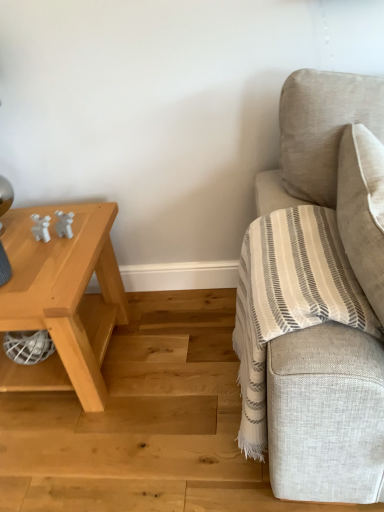
This screenshot has width=384, height=512. I want to click on natural wood stair at lower right, so click(x=143, y=422).

This screenshot has height=512, width=384. Find the location of `beige fabric couch at right`. beige fabric couch at right is located at coordinates (326, 415).

In order to face light wood table at left, should I rotate leftwards or rightwards?

You should look left and rotate roughly 19.737 degrees.

I want to click on natural wood stair at lower right, so click(x=143, y=422).

In the scene shown: Can you confirm if natural wood stair at lower right is positioned to the right of light wood table at left?

Indeed, natural wood stair at lower right is positioned on the right side of light wood table at left.

From the image's perspective, is natural wood stair at lower right under light wood table at left?

Correct, natural wood stair at lower right appears lower than light wood table at left in the image.

Is natural wood stair at lower right looking in the opposite direction of light wood table at left?

That's not correct — natural wood stair at lower right is not looking away from light wood table at left.

Can you confirm if natural wood stair at lower right is wider than light wood table at left?

Yes, natural wood stair at lower right is wider than light wood table at left.

Which object is further away from the camera, light wood table at left or natural wood stair at lower right?

light wood table at left.

Where is `table above the natural wood stair at lower right (from the image's perspective)`? The height and width of the screenshot is (512, 384). table above the natural wood stair at lower right (from the image's perspective) is located at coordinates (63, 298).

Could you tell me if light wood table at left is turned towards natural wood stair at lower right?

Yes, light wood table at left is oriented towards natural wood stair at lower right.

From the image's perspective, which is above, beige fabric couch at right or light wood table at left?

beige fabric couch at right is shown above in the image.

Is point (277, 390) in front of point (71, 336)?

Yes, it is in front of point (71, 336).

Is beige fabric couch at right turned away from light wood table at left?

That's right, beige fabric couch at right is facing away from light wood table at left.

From a real-world perspective, which object stands above the other?

beige fabric couch at right.

Is point (72, 301) positioned after point (331, 466)?

Yes, it is.

Which of these two, light wood table at left or beige fabric couch at right, is wider?

With larger width is light wood table at left.

Is light wood table at left next to beige fabric couch at right?

They are not placed beside each other.

Who is shorter, light wood table at left or beige fabric couch at right?

Standing shorter between the two is light wood table at left.

From a real-world perspective, between beige fabric couch at right and natural wood stair at lower right, who is vertically higher?

In real-world perspective, beige fabric couch at right is above.

Between beige fabric couch at right and natural wood stair at lower right, which one appears on the right side from the viewer's perspective?

beige fabric couch at right.

From the picture: From a real-world perspective, is natural wood stair at lower right above or below beige fabric couch at right?

In terms of real-world spatial position, natural wood stair at lower right is below beige fabric couch at right.

Which is closer to the camera, (145, 487) or (349, 355)?

Point (145, 487).

You are a GUI agent. You are given a task and a screenshot of the screen. Output one action in this format:
    pyautogui.click(x=<x>, y=<y>)
    Task: Click on the stair behind the beige fabric couch at right
    The image size is (384, 512).
    Given the screenshot: What is the action you would take?
    pyautogui.click(x=143, y=422)

In the image, is natural wood stair at lower right on the left side or the right side of beige fabric couch at right?

Clearly, natural wood stair at lower right is on the left of beige fabric couch at right in the image.

I want to click on stair on the right of light wood table at left, so click(x=143, y=422).

The image size is (384, 512). I want to click on table behind the natural wood stair at lower right, so click(63, 298).

Estimate the real-world distances between objects in this image. Which object is closer to light wood table at left, beige fabric couch at right or natural wood stair at lower right?

The object closer to light wood table at left is natural wood stair at lower right.

Estimate the real-world distances between objects in this image. Which object is closer to light wood table at left, natural wood stair at lower right or beige fabric couch at right?

natural wood stair at lower right is closer to light wood table at left.

Based on their spatial positions, is natural wood stair at lower right or light wood table at left closer to beige fabric couch at right?

natural wood stair at lower right lies closer to beige fabric couch at right than the other object.

Based on their spatial positions, is light wood table at left or natural wood stair at lower right further from beige fabric couch at right?

Based on the image, light wood table at left appears to be further to beige fabric couch at right.

Estimate the real-world distances between objects in this image. Which object is further from natural wood stair at lower right, beige fabric couch at right or light wood table at left?

beige fabric couch at right lies further to natural wood stair at lower right than the other object.

When comparing their distances from natural wood stair at lower right, does light wood table at left or beige fabric couch at right seem closer?

light wood table at left lies closer to natural wood stair at lower right than the other object.

Locate an element on the screen. stair between light wood table at left and beige fabric couch at right is located at coordinates (143, 422).